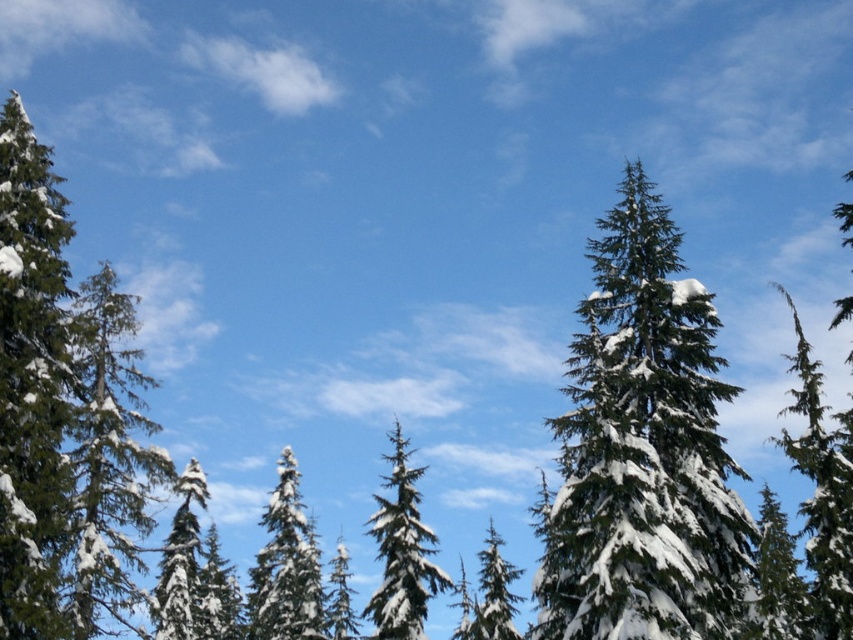
Is white snow-covered tree at center positioned behind snow-covered pine tree at center?

No.

Who is shorter, white snow-covered tree at center or snow-covered pine tree at center?

snow-covered pine tree at center

Who is more forward, (410, 497) or (276, 554)?

Point (410, 497) is more forward.

You are a GUI agent. You are given a task and a screenshot of the screen. Output one action in this format:
    pyautogui.click(x=<x>, y=<y>)
    Task: Click on the white snow-covered tree at center
    The image size is (853, 640).
    Given the screenshot: What is the action you would take?
    pyautogui.click(x=402, y=552)

Where is `green matte evergreen tree at left`? The image size is (853, 640). green matte evergreen tree at left is located at coordinates (109, 458).

Can you confirm if green matte evergreen tree at left is shorter than white snow-covered tree at center?

No.

Where is `green matte evergreen tree at left`? green matte evergreen tree at left is located at coordinates (109, 458).

Locate an element on the screen. green matte evergreen tree at left is located at coordinates (109, 458).

Does snow-covered evergreen at right come in front of white snow-covered tree at center?

Yes, snow-covered evergreen at right is closer to the viewer.

Is snow-covered evergreen at right below white snow-covered tree at center?

No.

Which is in front, point (688, 464) or point (393, 488)?

Positioned in front is point (688, 464).

You are a GUI agent. You are given a task and a screenshot of the screen. Output one action in this format:
    pyautogui.click(x=<x>, y=<y>)
    Task: Click on the snow-covered evergreen at right
    The width and height of the screenshot is (853, 640).
    Given the screenshot: What is the action you would take?
    pyautogui.click(x=643, y=451)